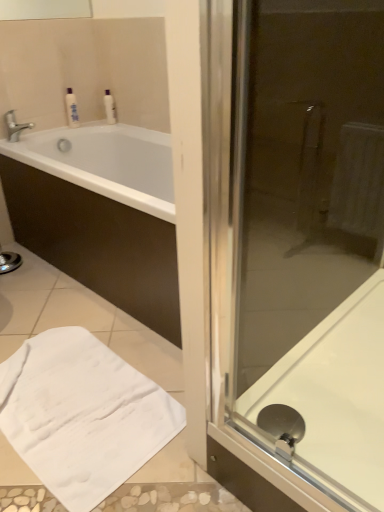
Locate an element on the screen. This screenshot has height=512, width=384. vacant area on top of white soft towel at lower left (from a real-world perspective) is located at coordinates 78,391.